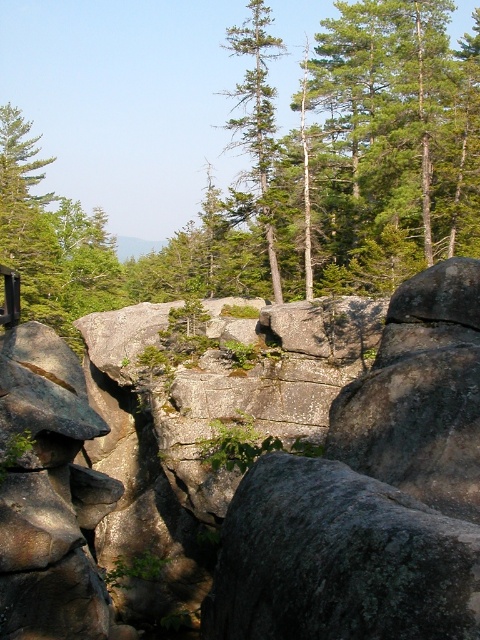
Who is positioned more to the right, green matte tree at upper left or green matte tree at upper center?

green matte tree at upper center

Does point (11, 244) come behind point (264, 86)?

That is True.

Which is in front, point (51, 259) or point (243, 29)?

Point (243, 29) is more forward.

Identify the location of green matte tree at upper left. (51, 240).